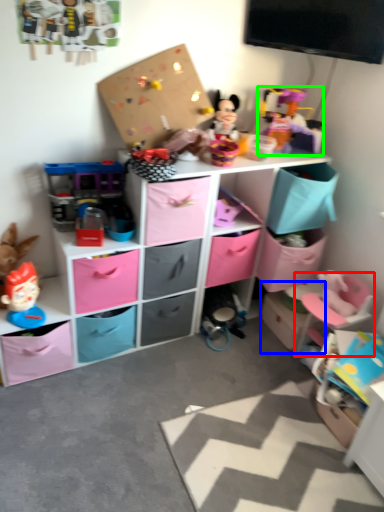
Question: Considering the real-world distances, which object is closest to swivel chair (highlighted by a red box)? storage box (highlighted by a blue box) or toy (highlighted by a green box).

Choices:
 (A) storage box
 (B) toy

Answer: (A)